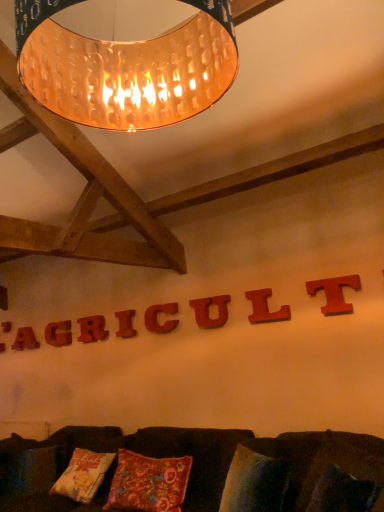
Question: Considering the positions of wooden letter at center, the seventh letter from the left, and matte wooden letter at upper center, which is the second letter in back-to-front order, in the image, is wooden letter at center, the seventh letter from the left, wider or thinner than matte wooden letter at upper center, which is the second letter in back-to-front order,?

Choices:
 (A) thin
 (B) wide

Answer: (A)

Question: Considering the positions of wooden letter at center, the 2th letter when ordered from front to back, and matte wooden letter at upper center, which appears as the seventh letter when viewed from the right, in the image, is wooden letter at center, the 2th letter when ordered from front to back, taller or shorter than matte wooden letter at upper center, which appears as the seventh letter when viewed from the right,?

Choices:
 (A) tall
 (B) short

Answer: (B)

Question: Which object is positioned closest to the copper hammered lampshade at upper center?

Choices:
 (A) wooden letter at center, the 4th letter in the right-to-left sequence
 (B) floral-patterned fabric pillow at center
 (C) velvet cushion at lower center
 (D) wooden letter at center, arranged as the 5th letter when viewed from the right
 (E) wooden letter at center, which is the 3th letter in back-to-front order

Answer: (C)

Question: Which is nearer to the velvet cushion at lower center?

Choices:
 (A) red wood letter u at center, acting as the 6th letter starting from the back
 (B) matte wooden letter at upper center, which is the second letter in back-to-front order
 (C) floral-patterned fabric pillow at center
 (D) wooden letter at upper center, the 1th letter from the back
 (E) matte red wooden t at upper center, the eighth letter in the back-to-front sequence

Answer: (C)